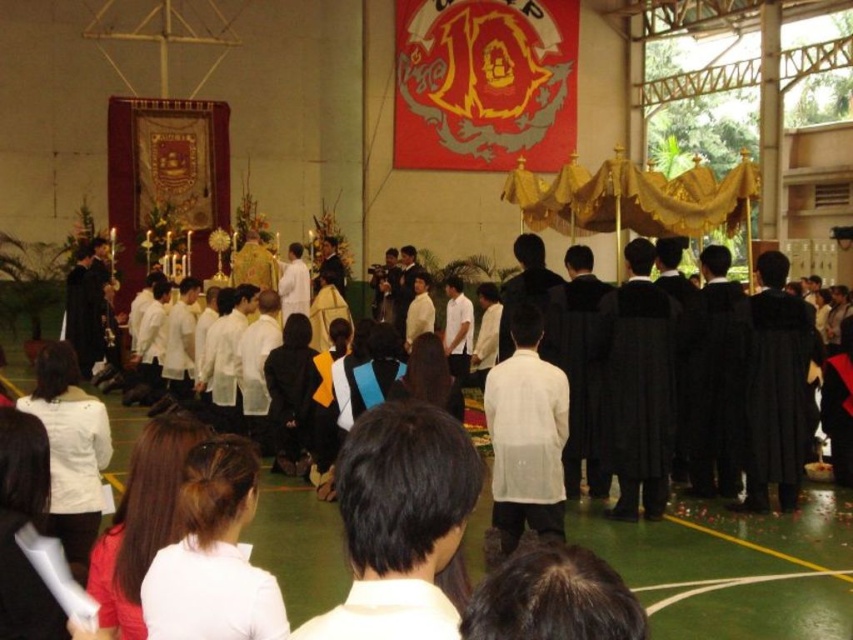
Question: Does white matte robe at center appear under white matte shirt at lower center?

Choices:
 (A) yes
 (B) no

Answer: (B)

Question: Is white matte robe at center smaller than white matte shirt at lower center?

Choices:
 (A) no
 (B) yes

Answer: (A)

Question: Which point appears farthest from the camera in this image?

Choices:
 (A) [x=358, y=634]
 (B) [x=227, y=602]

Answer: (B)

Question: Considering the real-world distances, which object is closest to the white matte shirt at lower center?

Choices:
 (A) white matte shirt at center
 (B) white matte robe at center

Answer: (A)

Question: Is white matte shirt at lower center positioned at the back of white matte shirt at center?

Choices:
 (A) no
 (B) yes

Answer: (B)

Question: Among these objects, which one is farthest from the camera?

Choices:
 (A) white matte shirt at center
 (B) white matte robe at center
 (C) white matte shirt at lower center

Answer: (B)